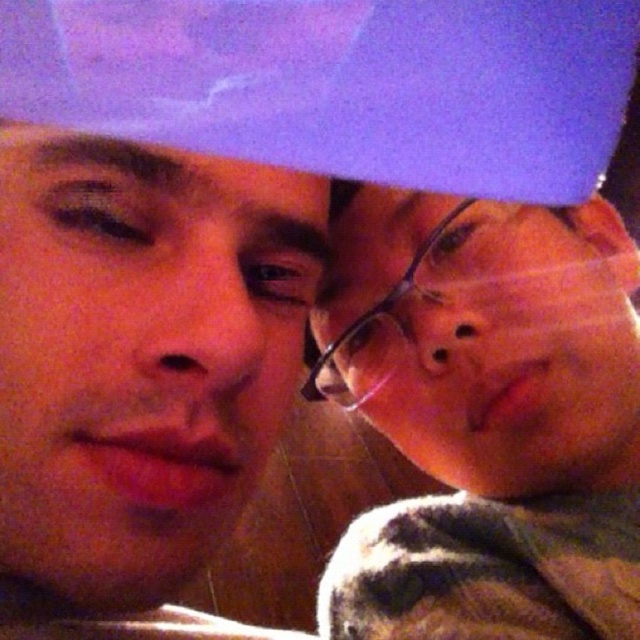
You are a photographer adjusting the focus of your camera. You need to ensure that both the matte black glasses at right and the smooth skin face at center are in focus. Given that the depth of field can only accommodate one of them clearly, which object should you prioritize focusing on to ensure it remains sharp?

The matte black glasses at right is taller than the smooth skin face at center, so focusing on the taller object, matte black glasses at right, would ensure it remains sharp as it occupies a more prominent position in the frame.

You are a photographer adjusting lighting for a portrait. You notice the matte black glasses at right and the smooth skin face at center in your frame. Which object should you focus on to ensure proper exposure if the glasses are reflecting too much light?

The matte black glasses at right is bigger than the smooth skin face at center, so focusing on the matte black glasses at right would be more effective to address the reflection issue since it occupies a larger area in the frame.

You are a photographer adjusting lighting for a portrait. You notice the matte black glasses at right and the smooth skin face at center in your frame. Which object would you need to adjust your lighting to avoid glare, considering their size?

The matte black glasses at right has a larger width than the smooth skin face at center, so you should adjust the lighting to avoid glare on the matte black glasses at right due to its larger size.